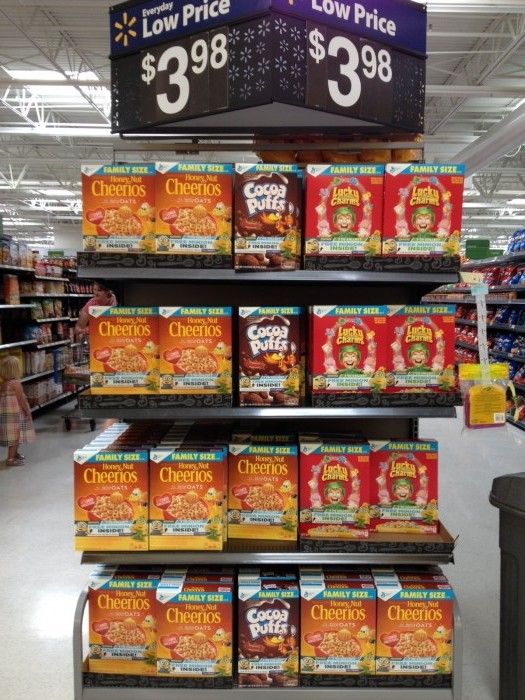
This screenshot has width=525, height=700. I want to click on cereal boxes on bottom shelf, so click(424, 620), click(342, 633), click(268, 634), click(197, 636), click(128, 620).